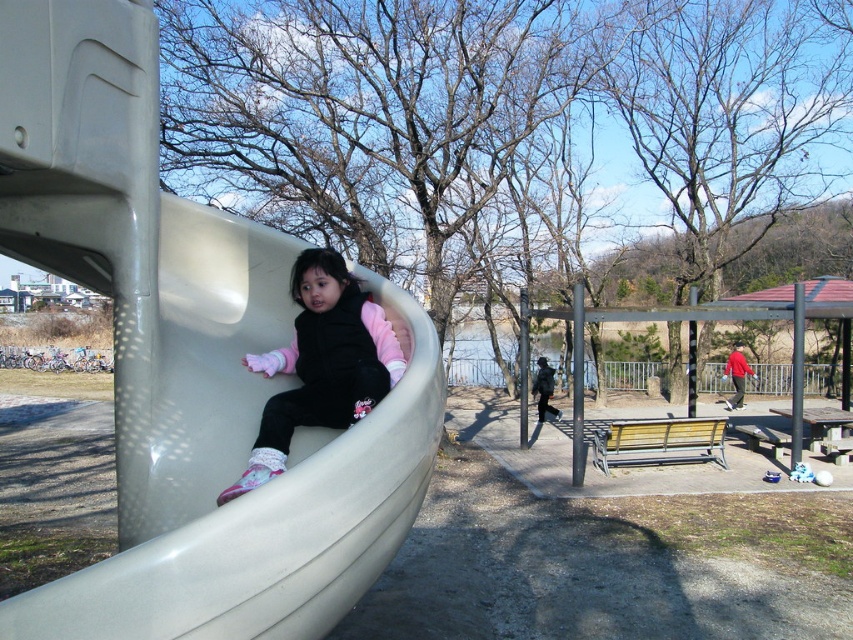
Question: Which point appears closest to the camera in this image?

Choices:
 (A) (392, 342)
 (B) (170, 458)

Answer: (B)

Question: Which point appears farthest from the camera in this image?

Choices:
 (A) (305, 358)
 (B) (281, 301)

Answer: (B)

Question: Can you confirm if smooth plastic slide at left is positioned above matte pink sweater at center?

Choices:
 (A) yes
 (B) no

Answer: (A)

Question: Does smooth plastic slide at left appear over matte pink sweater at center?

Choices:
 (A) no
 (B) yes

Answer: (B)

Question: Is smooth plastic slide at left to the left of matte pink sweater at center from the viewer's perspective?

Choices:
 (A) no
 (B) yes

Answer: (B)